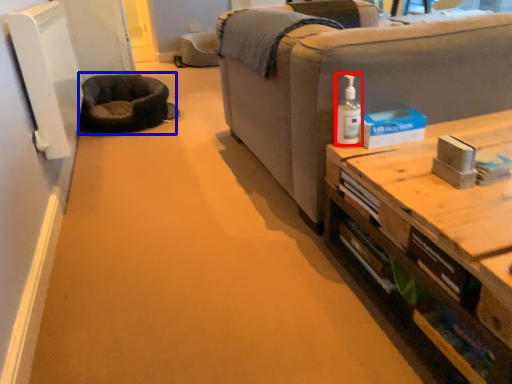
Question: Which object is further to the camera taking this photo, toiletry (highlighted by a red box) or cat bed (highlighted by a blue box)?

Choices:
 (A) toiletry
 (B) cat bed

Answer: (B)